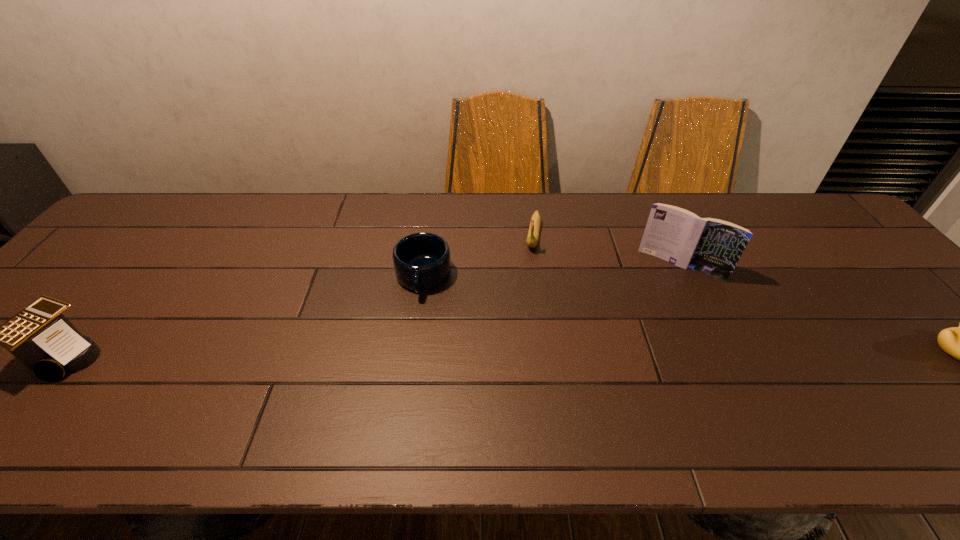
Where is `free space on the desktop that is between the leftmost object and the duckling and is positioned on the front cover of the tallest object`? Image resolution: width=960 pixels, height=540 pixels. free space on the desktop that is between the leftmost object and the duckling and is positioned on the front cover of the tallest object is located at coordinates (643, 353).

Find the location of a particular element. This screenshot has width=960, height=540. free space on the desktop that is between the calculator and the rightmost object and is positioned at the stem of the third object from left to right is located at coordinates (513, 353).

This screenshot has width=960, height=540. I want to click on free space on the desktop that is between the calculator and the duckling and is positioned with the handle on the side of the fourth object from right to left, so click(408, 354).